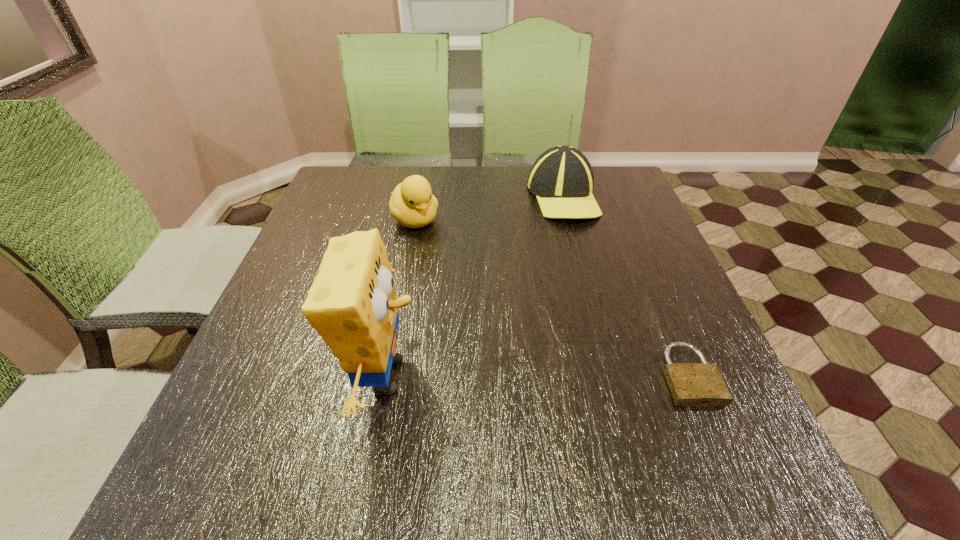
Where is `free point located 0.200m with the brim of the second object from right to left facing forward`? The height and width of the screenshot is (540, 960). free point located 0.200m with the brim of the second object from right to left facing forward is located at coordinates (567, 276).

The image size is (960, 540). In order to click on vacant area situated 0.160m on the front-facing side of the duck in this screenshot , I will do [x=457, y=267].

You are a GUI agent. You are given a task and a screenshot of the screen. Output one action in this format:
    pyautogui.click(x=<x>, y=<y>)
    Task: Click on the free space located 0.270m on the front-facing side of the duck
    The image size is (960, 540).
    Given the screenshot: What is the action you would take?
    pyautogui.click(x=482, y=295)

Locate an element on the screen. The image size is (960, 540). free region located 0.350m on the front-facing side of the duck is located at coordinates (503, 318).

You are a GUI agent. You are given a task and a screenshot of the screen. Output one action in this format:
    pyautogui.click(x=<x>, y=<y>)
    Task: Click on the baseball cap that is at the far edge
    This screenshot has width=960, height=540.
    Given the screenshot: What is the action you would take?
    pyautogui.click(x=562, y=179)

Image resolution: width=960 pixels, height=540 pixels. Find the location of `duck that is at the far edge`. duck that is at the far edge is located at coordinates (412, 204).

Find the location of `sponge that is positioned at the near edge`. sponge that is positioned at the near edge is located at coordinates (352, 304).

This screenshot has width=960, height=540. In order to click on padlock positioned at the near edge in this screenshot , I will do `click(691, 384)`.

Image resolution: width=960 pixels, height=540 pixels. What are the coordinates of `padlock that is at the right edge` in the screenshot? It's located at (691, 384).

This screenshot has height=540, width=960. I want to click on baseball cap at the right edge, so click(562, 179).